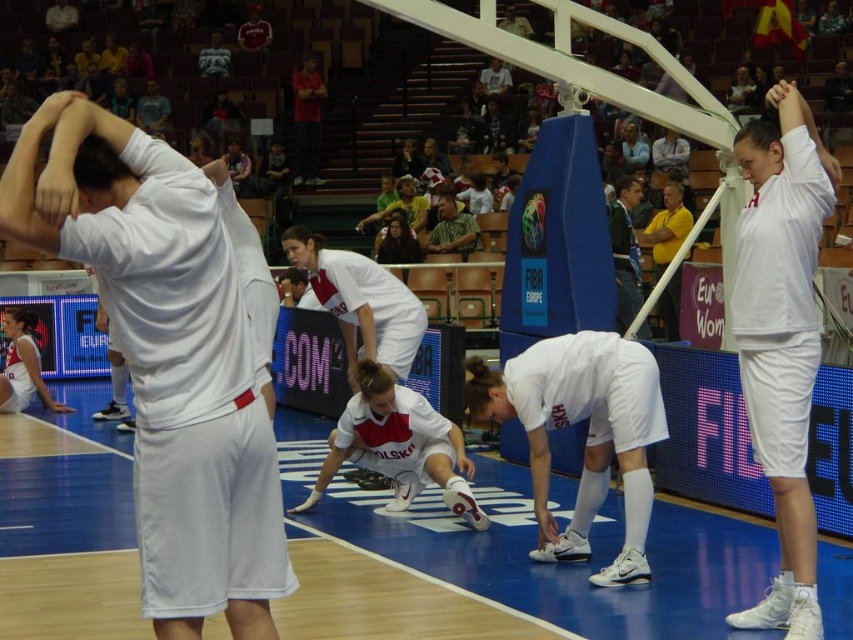
You are a photographer standing at the edge of the basketball court. You want to take a photo that includes both the blue rubber basketball court at center and the green fabric jacket at upper center. Which object should you zoom in on to ensure both are clearly visible in the frame?

You should zoom in on the green fabric jacket at upper center because it is smaller than the blue rubber basketball court at center, so focusing on it will help both fit into the frame.

You are a basketball coach standing at the edge of the court. You need to place a cone exactly at the center of the blue rubber basketball court at center. According to the coordinates provided, where should you place the cone?

The blue rubber basketball court at center is located at point [561,564], so you should place the cone at those coordinates to mark its center.